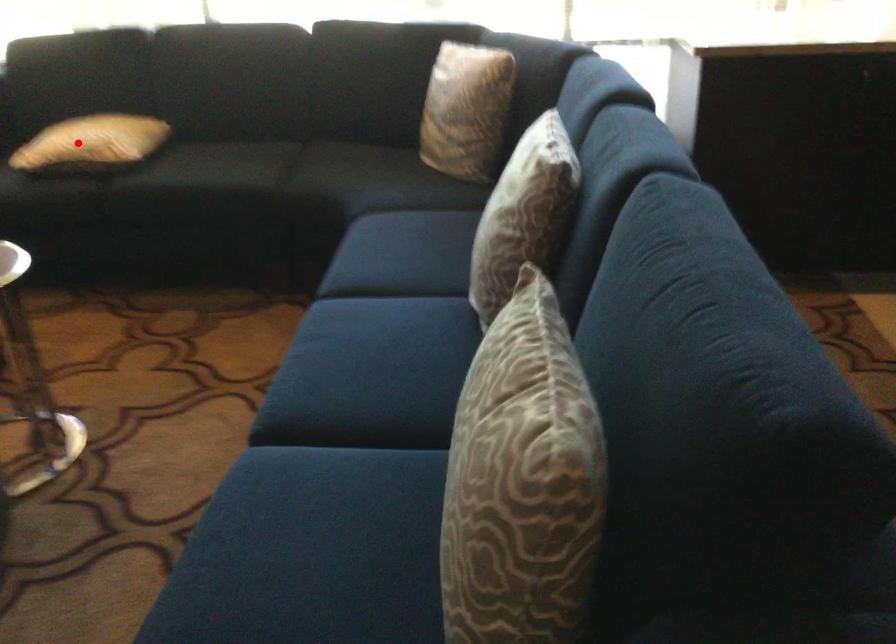
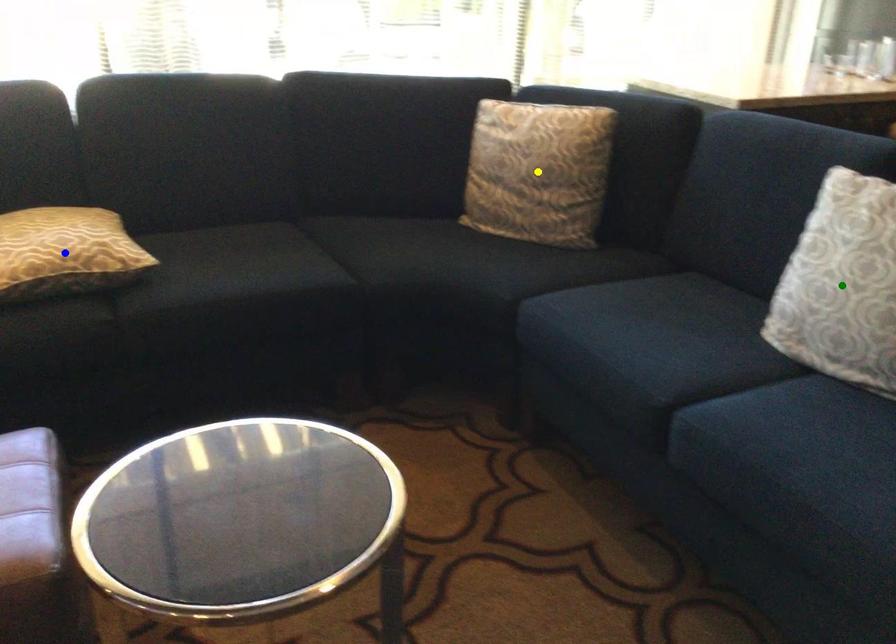
Question: I am providing you with two images of the same scene from different viewpoints. A red point is marked on the first image. You are given multiple points on the second image. Can you choose the point in image 2 that corresponds to the point in image 1?

Choices:
 (A) green point
 (B) blue point
 (C) yellow point

Answer: (B)